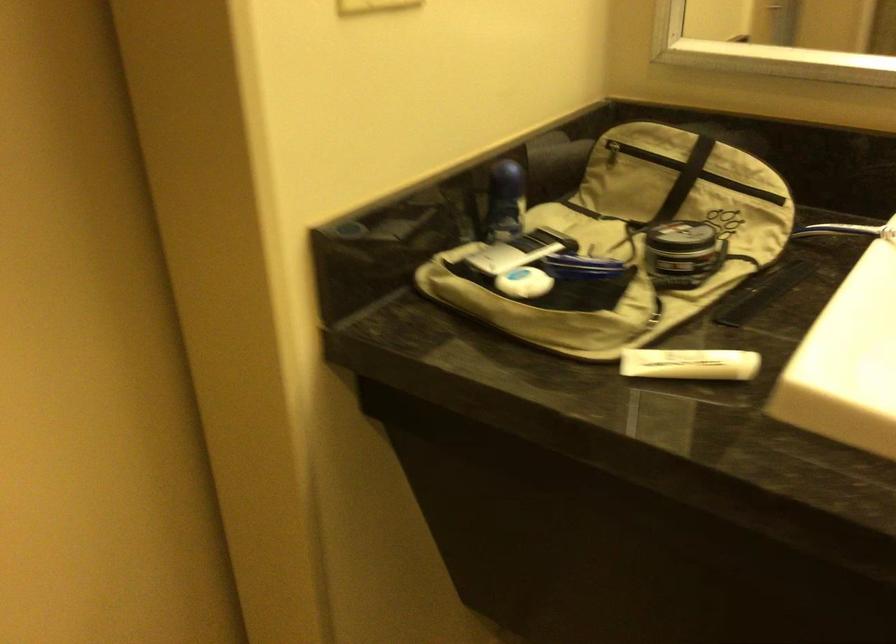
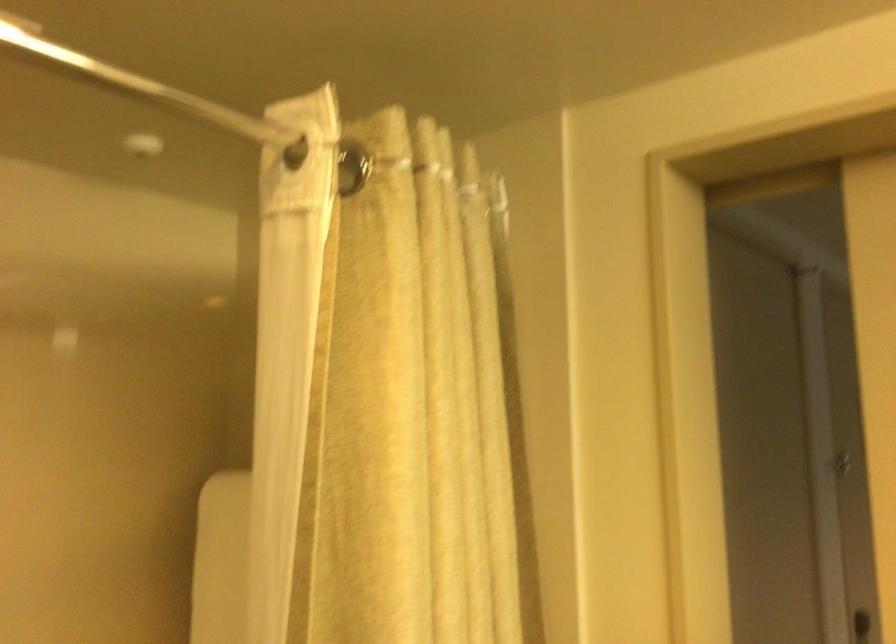
Question: The camera is either moving clockwise (left) or counter-clockwise (right) around the object. The first image is from the beginning of the video and the second image is from the end. Is the camera moving left or right when shooting the video?

Choices:
 (A) Left
 (B) Right

Answer: (B)